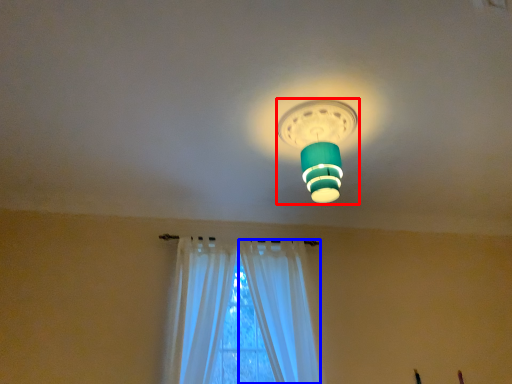
Question: Among these objects, which one is farthest to the camera, lamp (highlighted by a red box) or curtain (highlighted by a blue box)?

Choices:
 (A) lamp
 (B) curtain

Answer: (B)